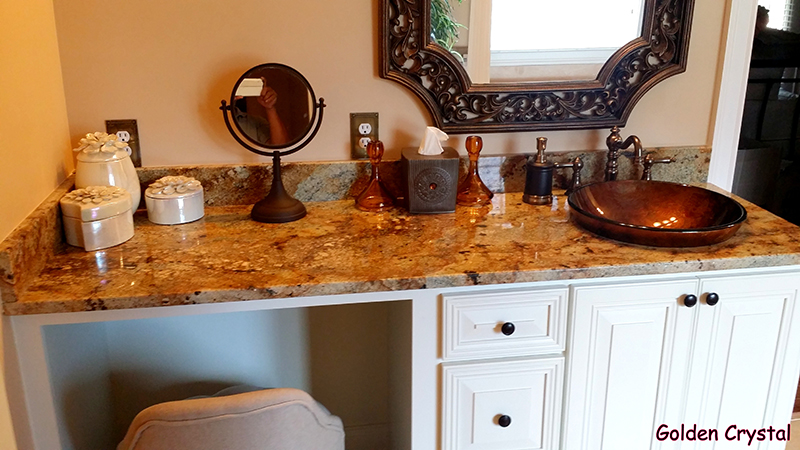
At what (x,y) coordinates should I click in order to perform the action: click on faucet. Please return your answer as a coordinate pair (x, y). Looking at the image, I should click on (616, 153).